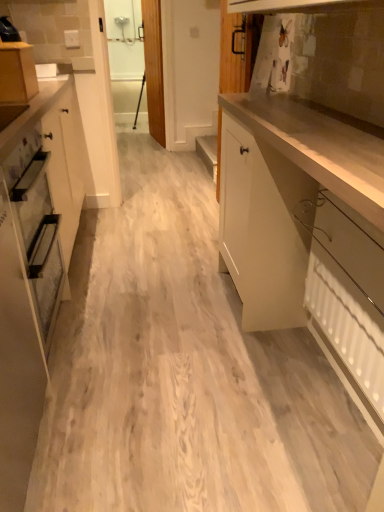
Locate an element on the screen. Image resolution: width=384 pixels, height=512 pixels. empty space that is in between white glossy cabinet at left, the 2th cabinetry when ordered from left to right, and glossy white cabinet at right, the 3th cabinetry positioned from the left is located at coordinates (169, 400).